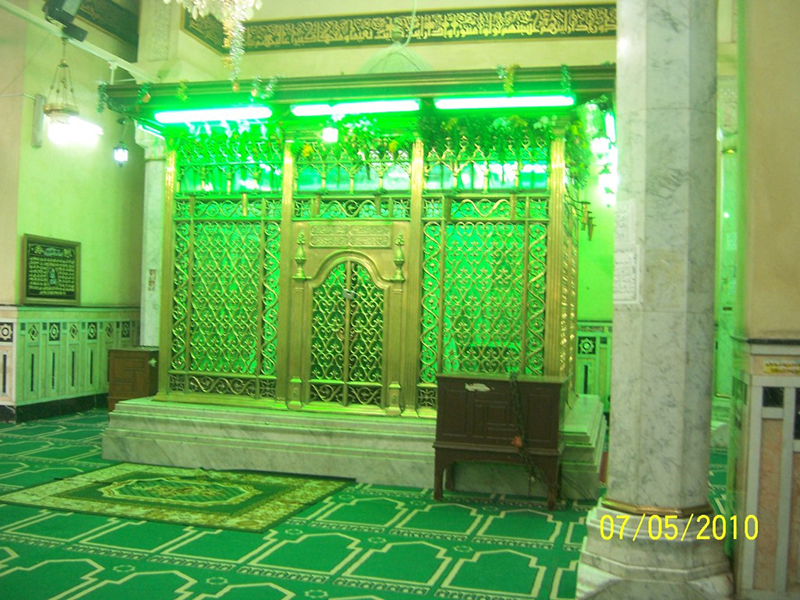
Where is `wall`? wall is located at coordinates (490, 50), (72, 200), (778, 242).